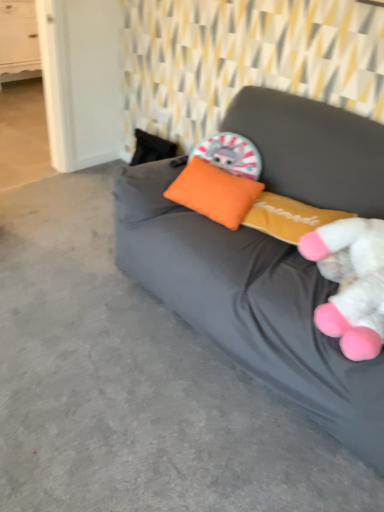
Question: Which is correct: matte gray bean bag at center is inside white wood drawer at upper left, or outside of it?

Choices:
 (A) outside
 (B) inside

Answer: (A)

Question: Considering the relative positions of matte gray bean bag at center and white wood drawer at upper left in the image provided, is matte gray bean bag at center to the left or to the right of white wood drawer at upper left?

Choices:
 (A) right
 (B) left

Answer: (A)

Question: Estimate the real-world distances between objects in this image. Which object is farther from the white plush toy at right?

Choices:
 (A) matte gray bean bag at center
 (B) white wood drawer at upper left
 (C) orange fabric pillow at center

Answer: (B)

Question: Estimate the real-world distances between objects in this image. Which object is farther from the white plush toy at right?

Choices:
 (A) orange fabric pillow at center
 (B) white wood drawer at upper left
 (C) matte gray bean bag at center

Answer: (B)